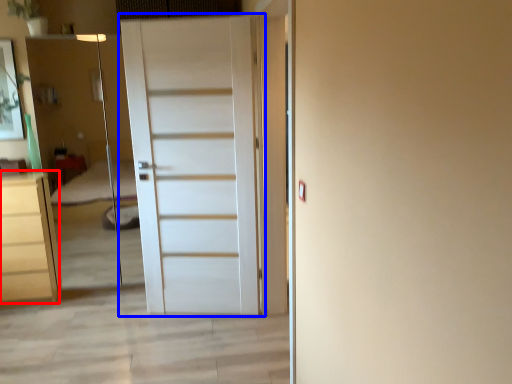
Question: Among these objects, which one is nearest to the camera, chest of drawers (highlighted by a red box) or door (highlighted by a blue box)?

Choices:
 (A) chest of drawers
 (B) door

Answer: (B)